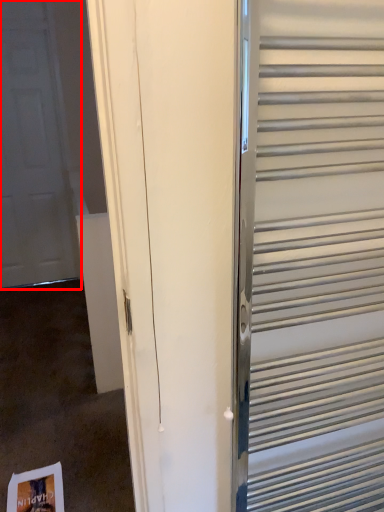
Question: From the image's perspective, what is the correct spatial relationship of door (annotated by the red box) in relation to elevator?

Choices:
 (A) below
 (B) above

Answer: (B)